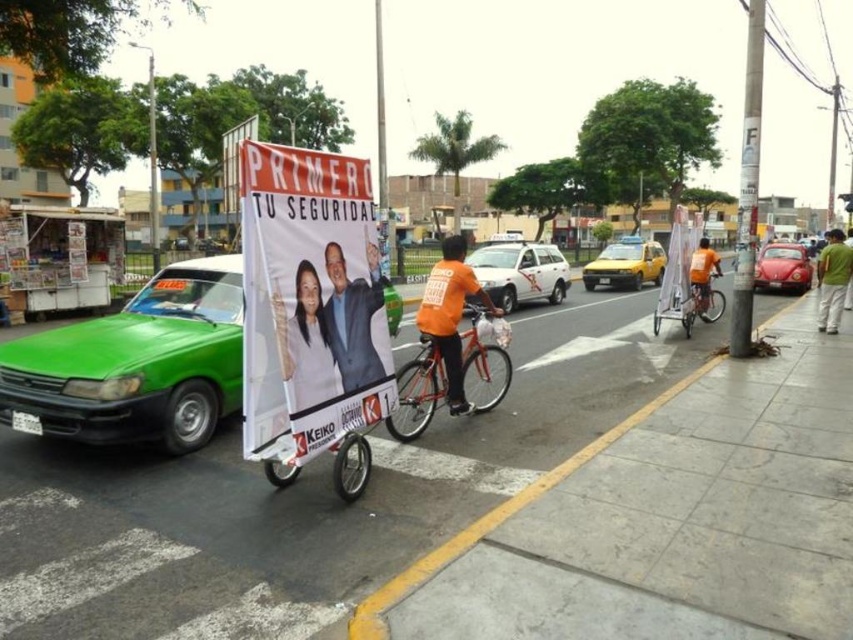
Question: Which point is closer to the camera?

Choices:
 (A) (720, 316)
 (B) (822, 328)
 (C) (325, 268)
 (D) (426, 323)

Answer: (C)

Question: In this image, where is white matte taxi at center located relative to metallic red car at right?

Choices:
 (A) below
 (B) above

Answer: (B)

Question: Can you confirm if smooth skin portrait at center is positioned to the left of metallic red car at right?

Choices:
 (A) yes
 (B) no

Answer: (A)

Question: Which object appears closest to the camera in this image?

Choices:
 (A) metallic red car at right
 (B) white paper banner at center

Answer: (B)

Question: Which of the following is the closest to the observer?

Choices:
 (A) smooth skin portrait at center
 (B) shiny metallic bicycle at center
 (C) orange fabric shirt at center

Answer: (A)

Question: Considering the relative positions of smooth plastic poster at center and green fabric shirt at lower right in the image provided, where is smooth plastic poster at center located with respect to green fabric shirt at lower right?

Choices:
 (A) below
 (B) above

Answer: (A)